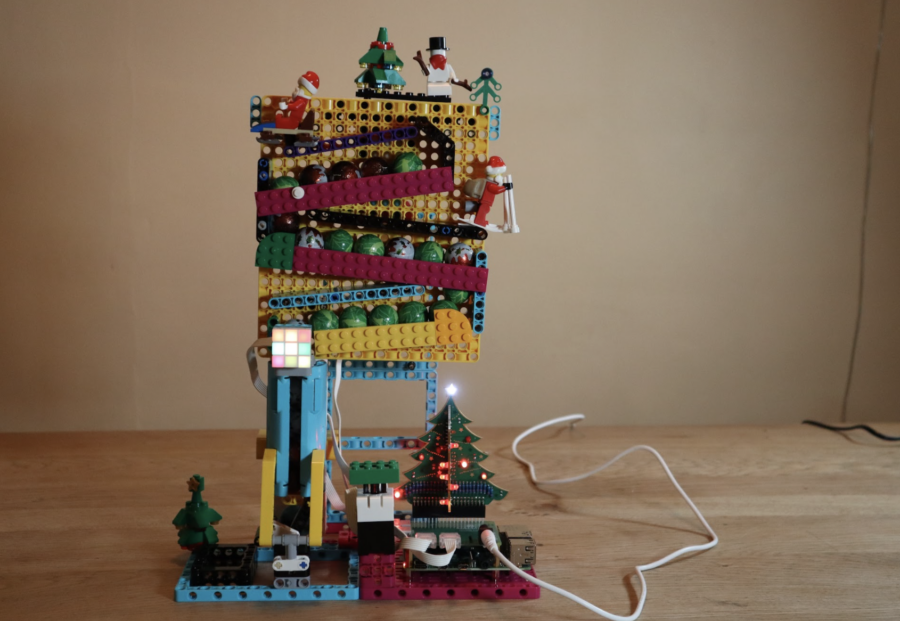
At what (x,y) coordinates should I click in order to perform the action: click on wall. Please return your answer as a coordinate pair (x, y). The image size is (900, 621). Looking at the image, I should click on (705, 148).